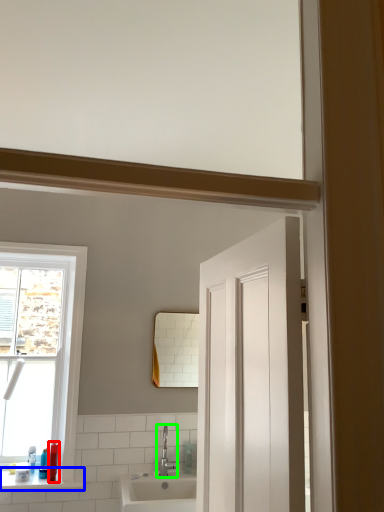
Question: Based on their relative distances, which object is nearer to toiletry (highlighted by a red box)? Choose from window sill (highlighted by a blue box) and tap (highlighted by a green box).

Choices:
 (A) window sill
 (B) tap

Answer: (A)